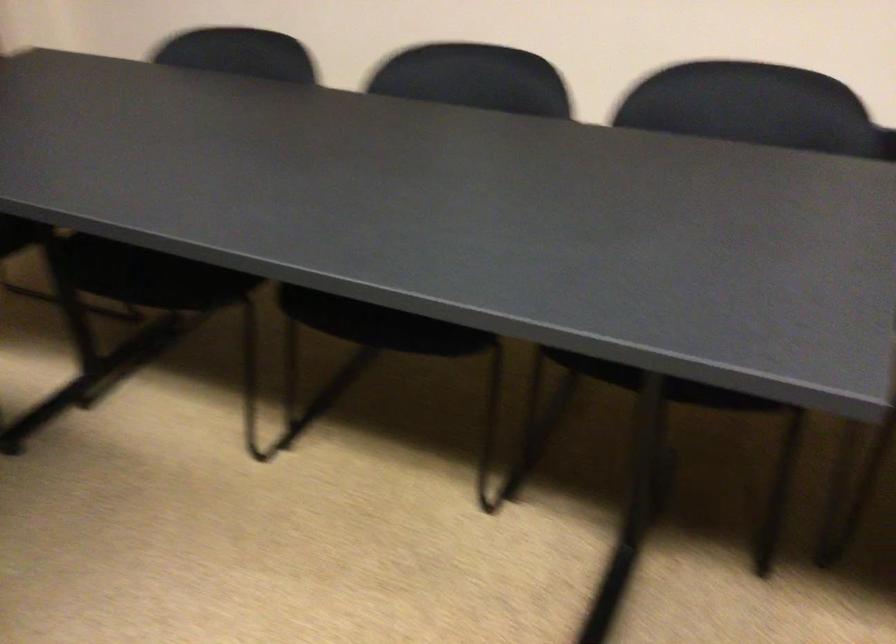
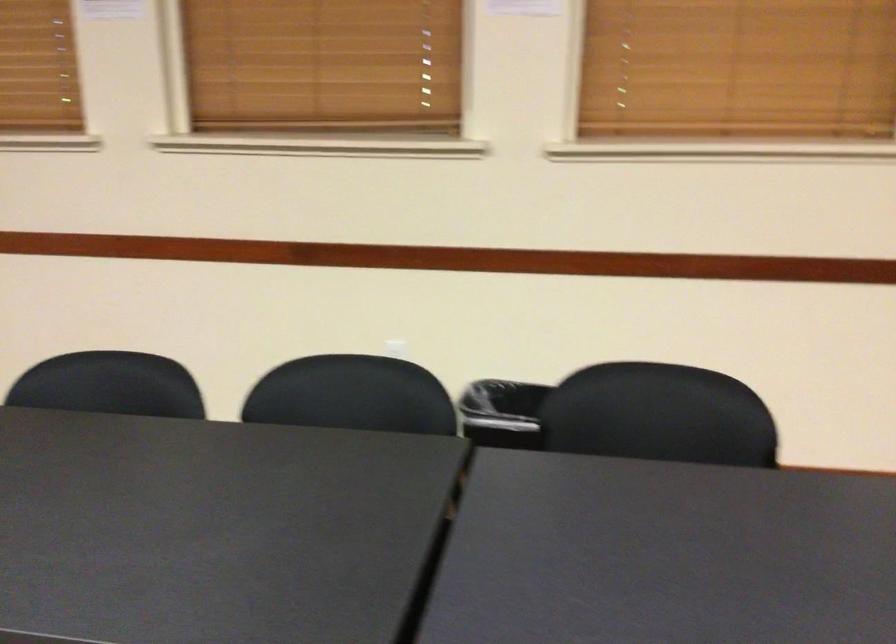
First-person continuous shooting, in which direction is the camera rotating?

The camera's rotation is toward right-up.